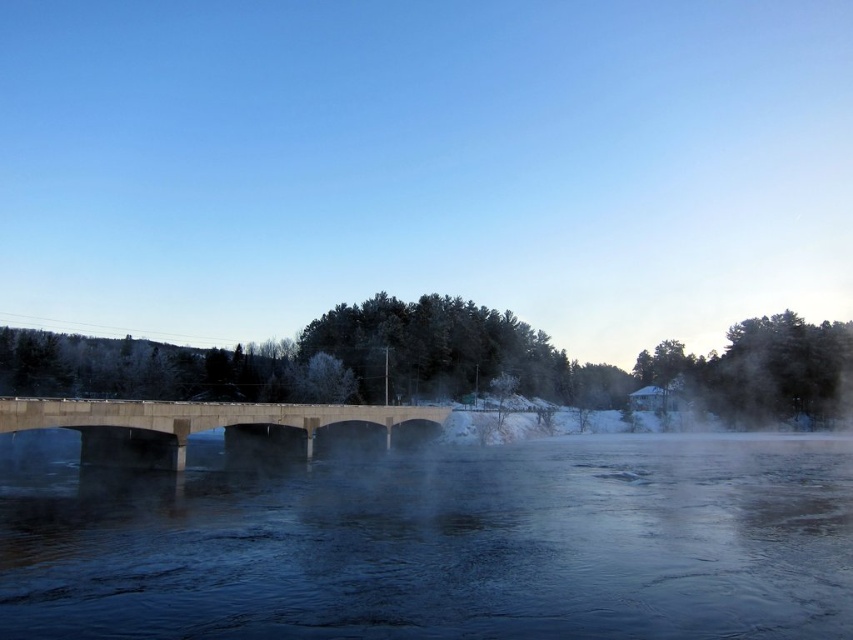
Can you confirm if dark blue water at center is shorter than concrete bridge at center?

Correct, dark blue water at center is not as tall as concrete bridge at center.

What do you see at coordinates (437, 544) in the screenshot? The width and height of the screenshot is (853, 640). I see `dark blue water at center` at bounding box center [437, 544].

You are a GUI agent. You are given a task and a screenshot of the screen. Output one action in this format:
    pyautogui.click(x=<x>, y=<y>)
    Task: Click on the dark blue water at center
    Image resolution: width=853 pixels, height=640 pixels.
    Given the screenshot: What is the action you would take?
    pyautogui.click(x=437, y=544)